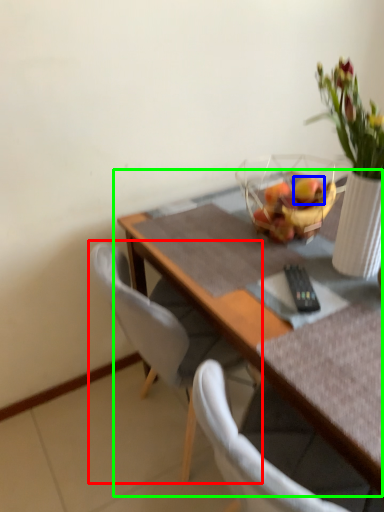
Question: Considering the real-world distances, which object is farthest from chair (highlighted by a red box)? flower (highlighted by a blue box) or table (highlighted by a green box)?

Choices:
 (A) flower
 (B) table

Answer: (A)